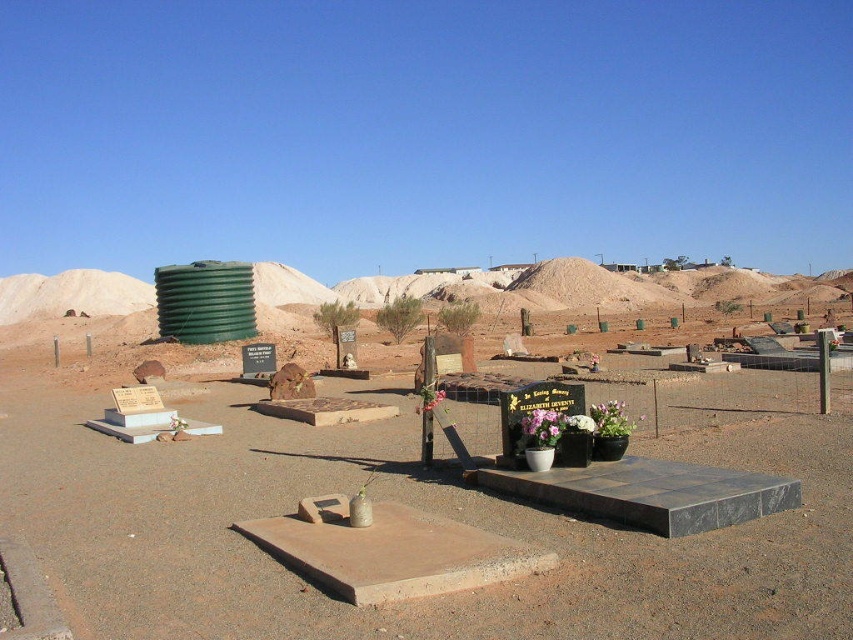
From the picture: Is green leafy shrub at center above white ceramic vase at center?

Indeed, green leafy shrub at center is positioned over white ceramic vase at center.

Does green leafy shrub at center have a lesser height compared to white ceramic vase at center?

No, green leafy shrub at center is not shorter than white ceramic vase at center.

The width and height of the screenshot is (853, 640). Find the location of `green leafy shrub at center`. green leafy shrub at center is located at coordinates (399, 316).

This screenshot has width=853, height=640. In order to click on green leafy shrub at center in this screenshot , I will do `click(399, 316)`.

Which is in front, point (444, 323) or point (567, 426)?

Positioned in front is point (567, 426).

Does green leafy bush at center appear over white ceramic vase at center?

Correct, green leafy bush at center is located above white ceramic vase at center.

Is point (438, 316) positioned after point (573, 413)?

Yes, it is behind point (573, 413).

The image size is (853, 640). I want to click on green leafy bush at center, so pyautogui.click(x=457, y=316).

Which is more to the right, purple fabric flower at center or green leafy bush at center?

From the viewer's perspective, green leafy bush at center appears more on the right side.

Does purple fabric flower at center have a smaller size compared to green leafy bush at center?

Yes, purple fabric flower at center is smaller than green leafy bush at center.

Is point (543, 444) less distant than point (466, 330)?

Yes, point (543, 444) is closer to viewer.

This screenshot has width=853, height=640. I want to click on purple fabric flower at center, so click(x=543, y=428).